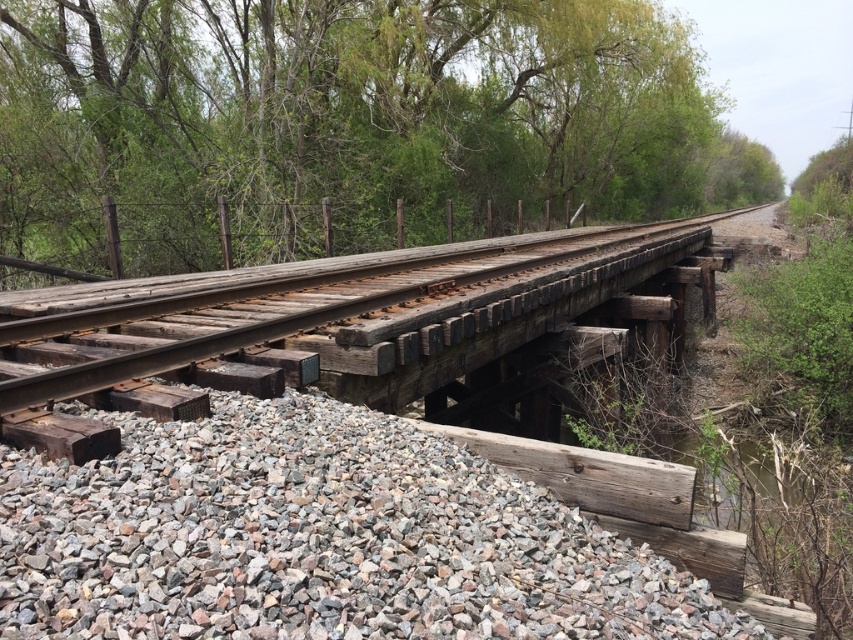
Question: Does green leafy tree at center have a greater width compared to gray gravel at lower left?

Choices:
 (A) no
 (B) yes

Answer: (B)

Question: Which object is farther from the camera taking this photo?

Choices:
 (A) gray gravel at lower left
 (B) rusty metal rail at center

Answer: (B)

Question: From the image, what is the correct spatial relationship of gray gravel at lower left in relation to rusty metal rail at center?

Choices:
 (A) right
 (B) left

Answer: (B)

Question: Which object is positioned closest to the green leafy tree at center?

Choices:
 (A) rusty metal rail at center
 (B) gray gravel at lower left

Answer: (A)

Question: Which point is closer to the camera?

Choices:
 (A) green leafy tree at center
 (B) gray gravel at lower left

Answer: (B)

Question: Can you confirm if green leafy tree at center is positioned above gray gravel at lower left?

Choices:
 (A) no
 (B) yes

Answer: (B)